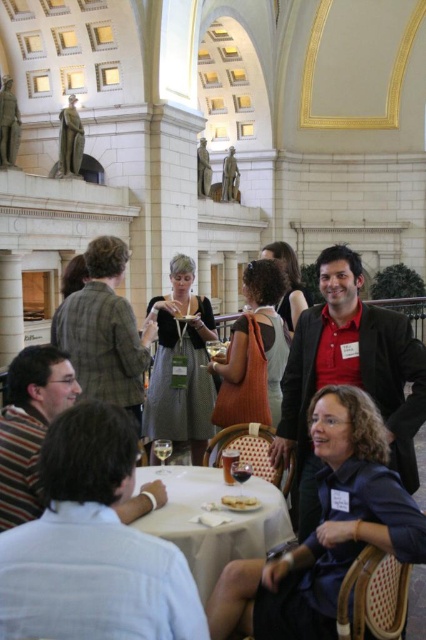
Is blue fabric dress at lower center behind white cloth table at center?

No, blue fabric dress at lower center is in front of white cloth table at center.

Image resolution: width=426 pixels, height=640 pixels. What do you see at coordinates (325, 531) in the screenshot? I see `blue fabric dress at lower center` at bounding box center [325, 531].

You are a GUI agent. You are given a task and a screenshot of the screen. Output one action in this format:
    pyautogui.click(x=<x>, y=<y>)
    Task: Click on the blue fabric dress at lower center
    The image size is (426, 640).
    Given the screenshot: What is the action you would take?
    pyautogui.click(x=325, y=531)

Based on the photo, does clear glass wine glass at center have a larger size compared to transparent glass wine at table center?

A: Indeed, clear glass wine glass at center has a larger size compared to transparent glass wine at table center.

Can you confirm if clear glass wine glass at center is positioned to the right of transparent glass wine at table center?

In fact, clear glass wine glass at center is to the left of transparent glass wine at table center.

Does point (161, 461) come in front of point (233, 468)?

No.

Locate an element on the screen. This screenshot has height=640, width=426. clear glass wine glass at center is located at coordinates (163, 451).

Between white cloth table at center and bronze statue at center, which one appears on the right side from the viewer's perspective?

Positioned to the right is bronze statue at center.

Is white cloth table at center thinner than bronze statue at center?

In fact, white cloth table at center might be wider than bronze statue at center.

Between point (184, 468) and point (232, 186), which one is positioned behind?

Point (232, 186)

In order to click on white cloth table at center in this screenshot , I will do `click(213, 522)`.